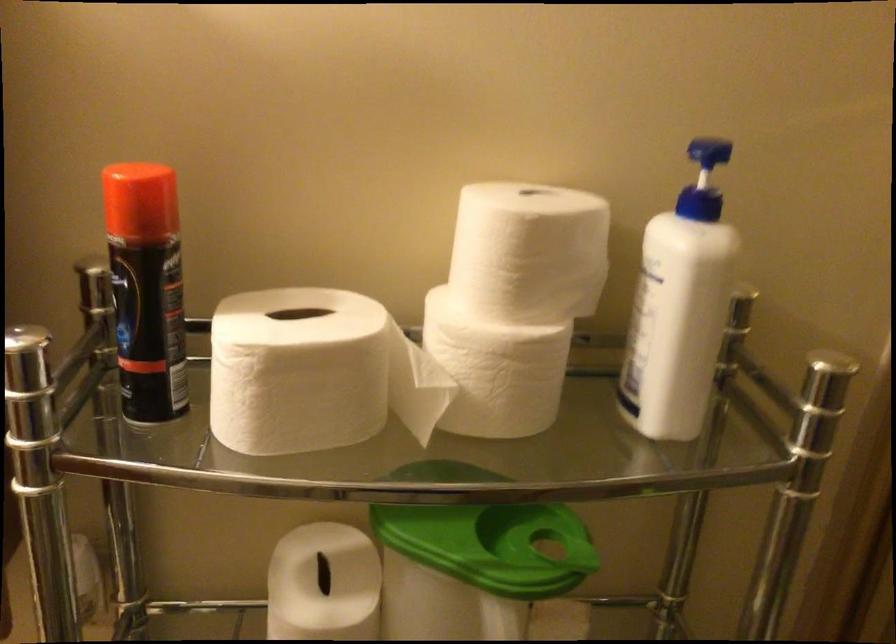
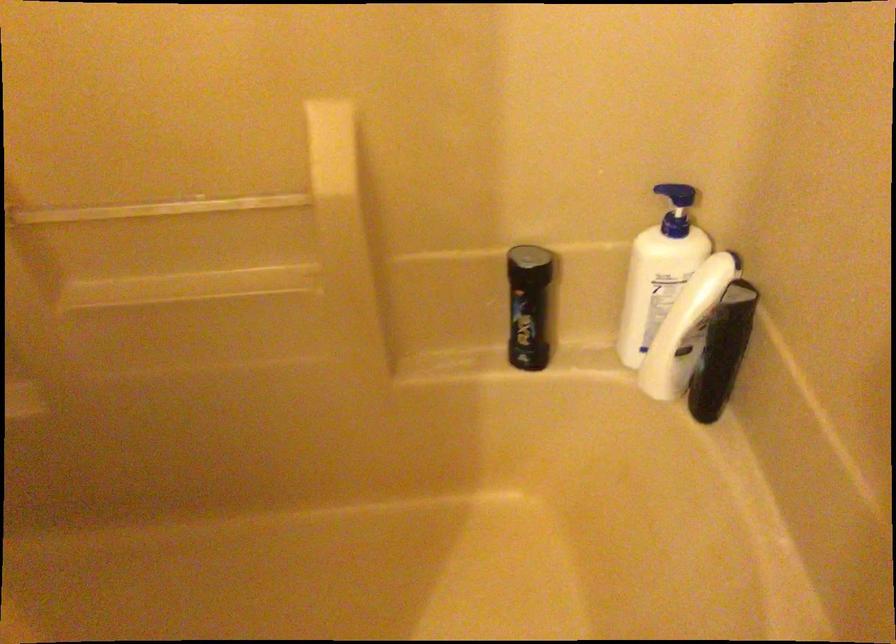
From the picture: The first image is from the beginning of the video and the second image is from the end. How did the camera likely rotate when shooting the video?

The camera's rotation is toward right-down.